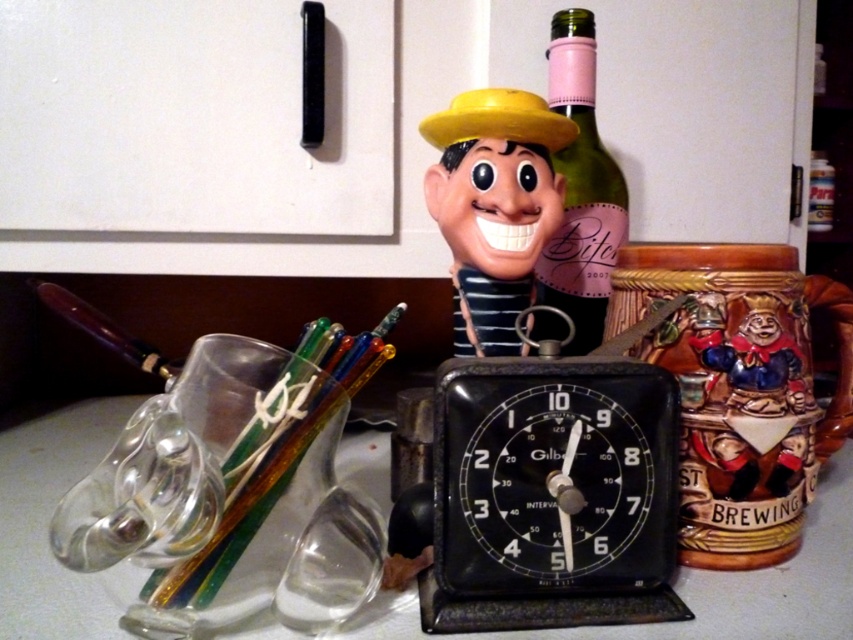
Question: Which point is closer to the camera?

Choices:
 (A) (247, 632)
 (B) (508, 339)
 (C) (532, 428)
 (D) (547, 296)

Answer: (A)

Question: Is clear glass cup at center bigger than green glass bottle at center?

Choices:
 (A) no
 (B) yes

Answer: (B)

Question: Does black metal/aluminum alarm clock at center have a greater width compared to clear glass cup at center?

Choices:
 (A) no
 (B) yes

Answer: (A)

Question: Which point is farther to the camera?

Choices:
 (A) (679, 570)
 (B) (621, 444)

Answer: (A)

Question: Can you confirm if matte plastic head at center is positioned above green glass bottle at center?

Choices:
 (A) yes
 (B) no

Answer: (B)

Question: Which point is farther to the camera?

Choices:
 (A) (476, 234)
 (B) (582, 168)
 (C) (340, 476)
 (D) (527, 417)

Answer: (C)